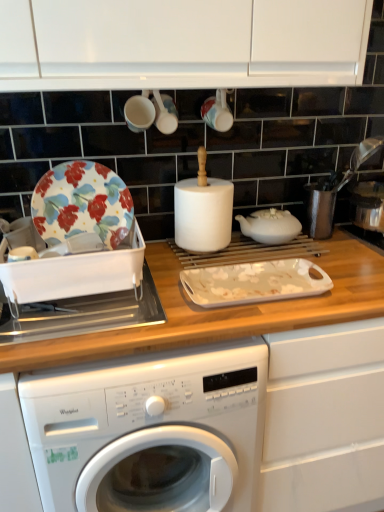
Question: In which direction should I rotate to look at matte white cup at upper center, the first tableware when ordered from left to right?

Choices:
 (A) left
 (B) right

Answer: (A)

Question: Does floral-patterned ceramic plate at left have a greater height compared to white plastic dish rack at left?

Choices:
 (A) yes
 (B) no

Answer: (A)

Question: Would you say floral-patterned ceramic plate at left contains white plastic dish rack at left?

Choices:
 (A) no
 (B) yes

Answer: (A)

Question: Is floral-patterned ceramic plate at left touching white plastic dish rack at left?

Choices:
 (A) yes
 (B) no

Answer: (B)

Question: Is floral-patterned ceramic plate at left thinner than white plastic dish rack at left?

Choices:
 (A) yes
 (B) no

Answer: (A)

Question: Is floral-patterned ceramic plate at left to the right of white plastic dish rack at left from the viewer's perspective?

Choices:
 (A) no
 (B) yes

Answer: (B)

Question: Is floral-patterned ceramic plate at left bigger than white plastic dish rack at left?

Choices:
 (A) yes
 (B) no

Answer: (B)

Question: Is matte white cup at upper center, the first tableware when ordered from left to right, looking in the opposite direction of white glossy cup at upper center, the 2th tableware in the right-to-left sequence?

Choices:
 (A) no
 (B) yes

Answer: (A)

Question: From the image's perspective, is matte white cup at upper center, which is the 3th tableware in right-to-left order, located beneath white glossy cup at upper center, the 2th tableware in the right-to-left sequence?

Choices:
 (A) yes
 (B) no

Answer: (A)

Question: Could you tell me if matte white cup at upper center, the first tableware when ordered from left to right, is facing white glossy cup at upper center, positioned as the 2th tableware in left-to-right order?

Choices:
 (A) yes
 (B) no

Answer: (B)

Question: Is matte white cup at upper center, the first tableware when ordered from left to right, directly adjacent to white glossy cup at upper center, the 2th tableware in the right-to-left sequence?

Choices:
 (A) yes
 (B) no

Answer: (A)

Question: Considering the relative positions of matte white cup at upper center, the first tableware when ordered from left to right, and white glossy cup at upper center, the 2th tableware in the right-to-left sequence, in the image provided, is matte white cup at upper center, the first tableware when ordered from left to right, behind white glossy cup at upper center, the 2th tableware in the right-to-left sequence,?

Choices:
 (A) yes
 (B) no

Answer: (B)

Question: Is white glossy cup at upper center, positioned as the 2th tableware in left-to-right order, inside matte white cup at upper center, which is the 3th tableware in right-to-left order?

Choices:
 (A) yes
 (B) no

Answer: (B)

Question: Is wooden at center a part of white glossy cup at upper center, the 2th tableware in the right-to-left sequence?

Choices:
 (A) yes
 (B) no

Answer: (B)